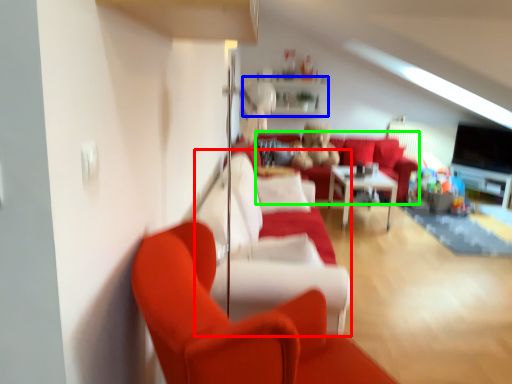
Question: Which object is positioned closest to couch (highlighted by a red box)? Select from shelf (highlighted by a blue box) and couch (highlighted by a green box).

Choices:
 (A) shelf
 (B) couch

Answer: (A)